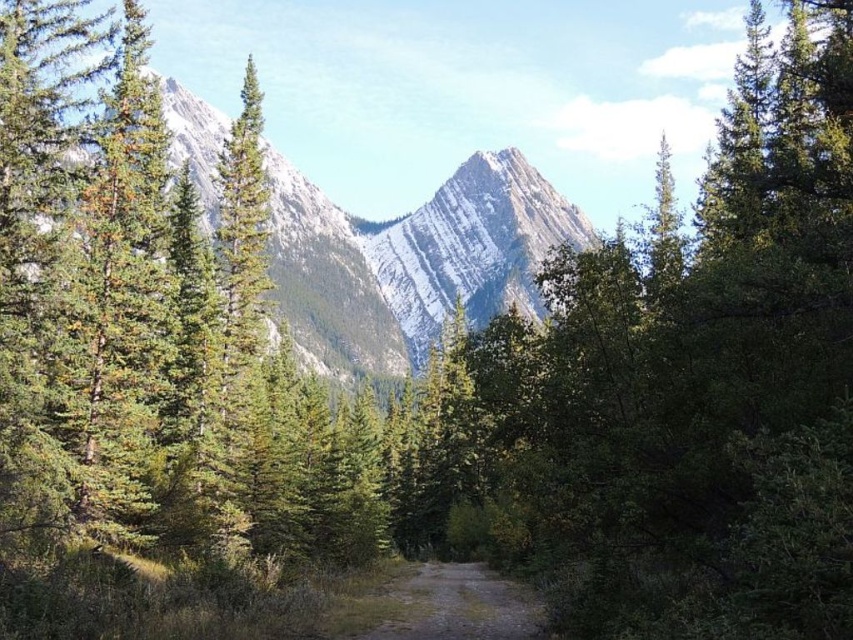
Question: Which point is farther to the camera?

Choices:
 (A) (419, 262)
 (B) (442, 595)

Answer: (A)

Question: In this image, where is snowy granite peak at center located relative to brown dirt path at center?

Choices:
 (A) above
 (B) below

Answer: (A)

Question: Is snowy granite peak at center thinner than brown dirt path at center?

Choices:
 (A) no
 (B) yes

Answer: (A)

Question: Is snowy granite peak at center closer to camera compared to brown dirt path at center?

Choices:
 (A) no
 (B) yes

Answer: (A)

Question: Among these objects, which one is farthest from the camera?

Choices:
 (A) snowy granite peak at center
 (B) brown dirt path at center

Answer: (A)